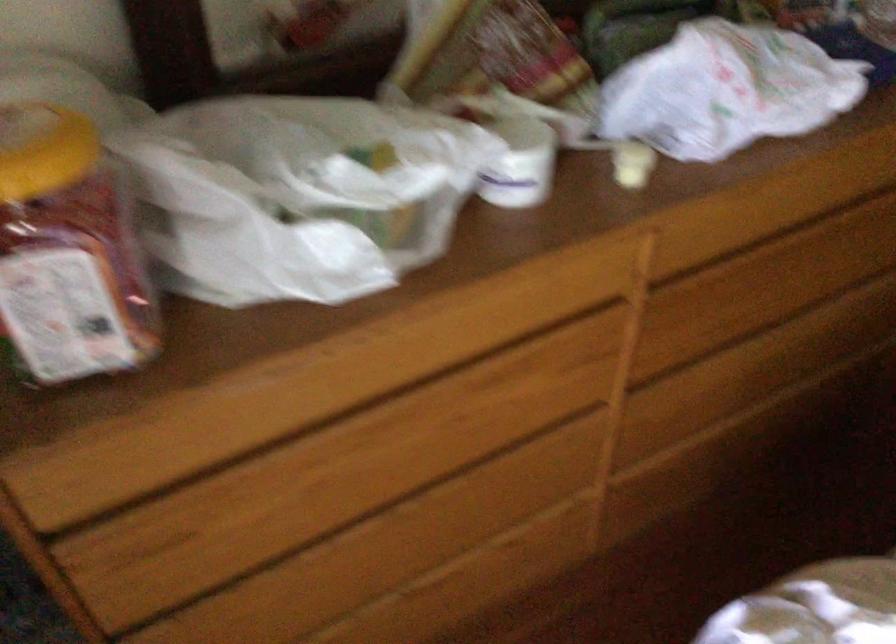
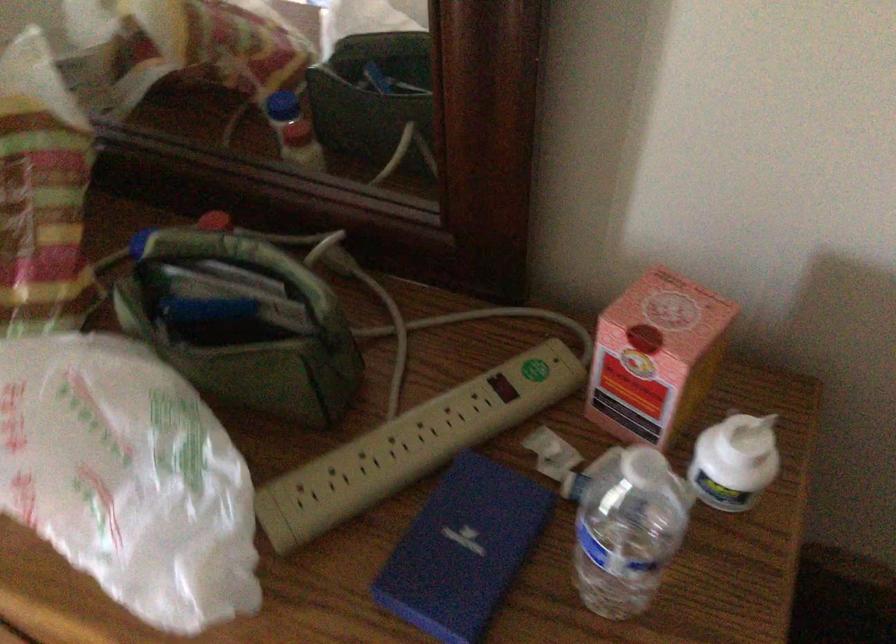
Locate, in the second image, the point that corresponds to (757,77) in the first image.

(126, 478)